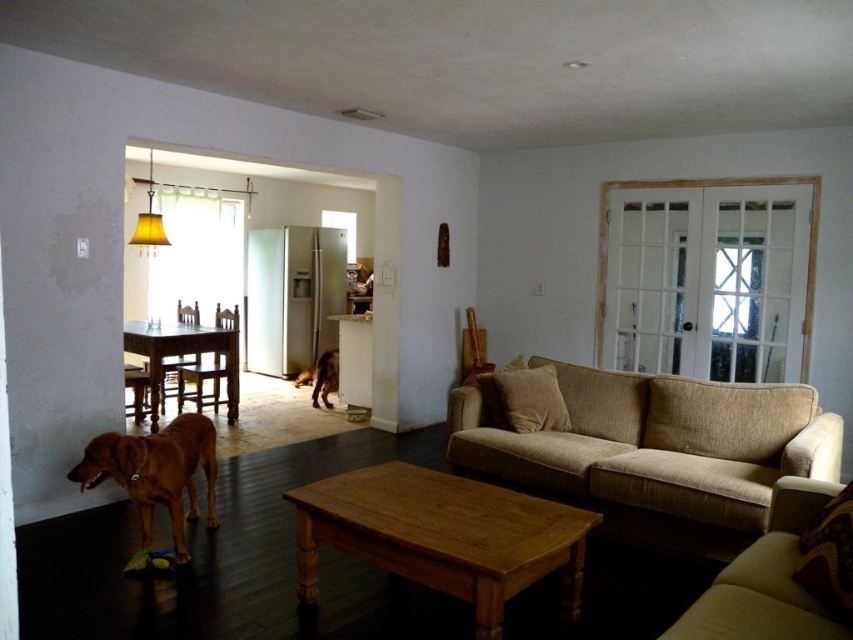
Question: In this image, where is beige fabric couch at lower right located relative to wooden table at left?

Choices:
 (A) above
 (B) below

Answer: (B)

Question: Does brown furry dog at lower left have a larger size compared to brown furry dog at center?

Choices:
 (A) yes
 (B) no

Answer: (A)

Question: Which object is farther from the camera taking this photo?

Choices:
 (A) brown furry dog at lower left
 (B) brown furry dog at center
 (C) beige fabric couch at lower right

Answer: (B)

Question: Which point is closer to the camera?

Choices:
 (A) (173, 356)
 (B) (328, 384)
 (C) (193, 336)

Answer: (C)

Question: In this image, where is wooden table at left located relative to brown furry dog at center?

Choices:
 (A) above
 (B) below

Answer: (A)

Question: Among these objects, which one is nearest to the camera?

Choices:
 (A) brown wooden chair at center
 (B) wooden coffee table at center

Answer: (B)